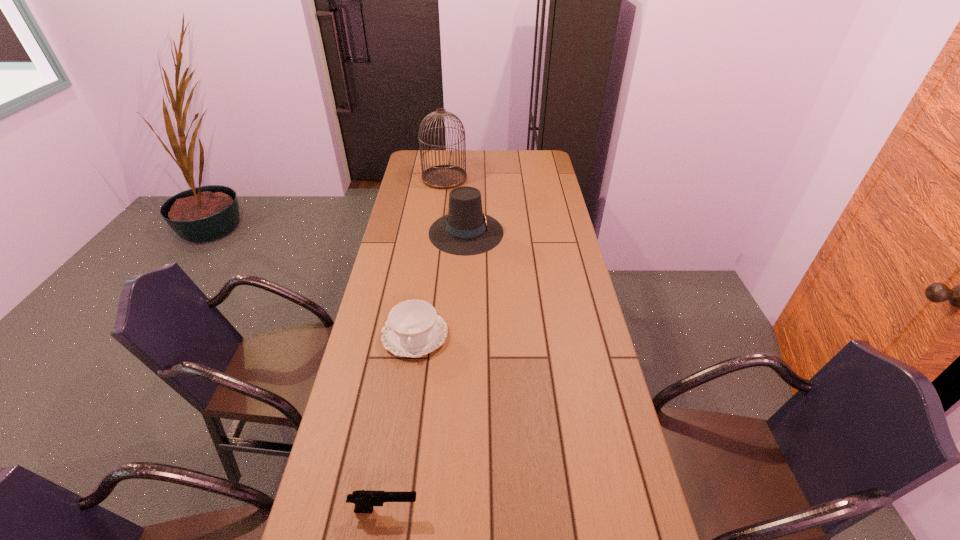
The height and width of the screenshot is (540, 960). What are the coordinates of `vacant area that lies between the nearest object and the second farthest object` in the screenshot? It's located at (425, 371).

Identify the location of free area in between the third farthest object and the pistol. This screenshot has width=960, height=540. (399, 422).

Image resolution: width=960 pixels, height=540 pixels. I want to click on free space between the pistol and the second nearest object, so click(x=399, y=422).

Where is `free space between the pistol and the third farthest object`? free space between the pistol and the third farthest object is located at coordinates (399, 422).

Identify which object is the closest to the farthest object. Please provide its 2D coordinates. Your answer should be formatted as a tuple, i.e. [(x, y)], where the tuple contains the x and y coordinates of a point satisfying the conditions above.

[(466, 230)]

The image size is (960, 540). I want to click on object that is the closest to the hat, so click(444, 176).

This screenshot has height=540, width=960. What are the coordinates of `free space in the image that satisfies the following two spatial constraints: 1. on the handle side of the chinaware; 2. on the front-facing side of the nearest object` in the screenshot? It's located at (389, 510).

At what (x,y) coordinates should I click in order to perform the action: click on vacant space that satisfies the following two spatial constraints: 1. on the front-facing side of the third nearest object; 2. on the handle side of the chinaware. Please return your answer as a coordinate pair (x, y). Looking at the image, I should click on (462, 335).